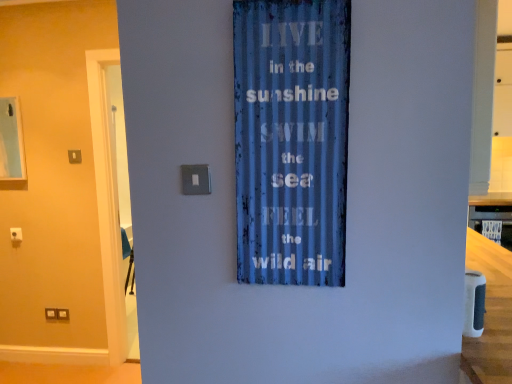
Question: In terms of height, does satin silver switch at center, the 1th light switch viewed from the front, look taller or shorter compared to satin silver switch at upper center, acting as the second light switch starting from the bottom?

Choices:
 (A) short
 (B) tall

Answer: (A)

Question: Is satin silver switch at center, placed as the 2th light switch when sorted from top to bottom, bigger or smaller than satin silver switch at upper center, acting as the second light switch starting from the bottom?

Choices:
 (A) big
 (B) small

Answer: (B)

Question: Which object is positioned closest to the satin silver switch at upper center, which is the first light switch in top-to-bottom order?

Choices:
 (A) blue corrugated metal sign at center
 (B) satin silver switch at center, which is the first light switch from right to left
 (C) smooth wooden counter top at right

Answer: (B)

Question: Estimate the real-world distances between objects in this image. Which object is farther from the smooth wooden counter top at right?

Choices:
 (A) satin silver switch at upper center, the first light switch viewed from the back
 (B) blue corrugated metal sign at center
 (C) satin silver switch at center, which is counted as the 1th light switch, starting from the bottom

Answer: (A)